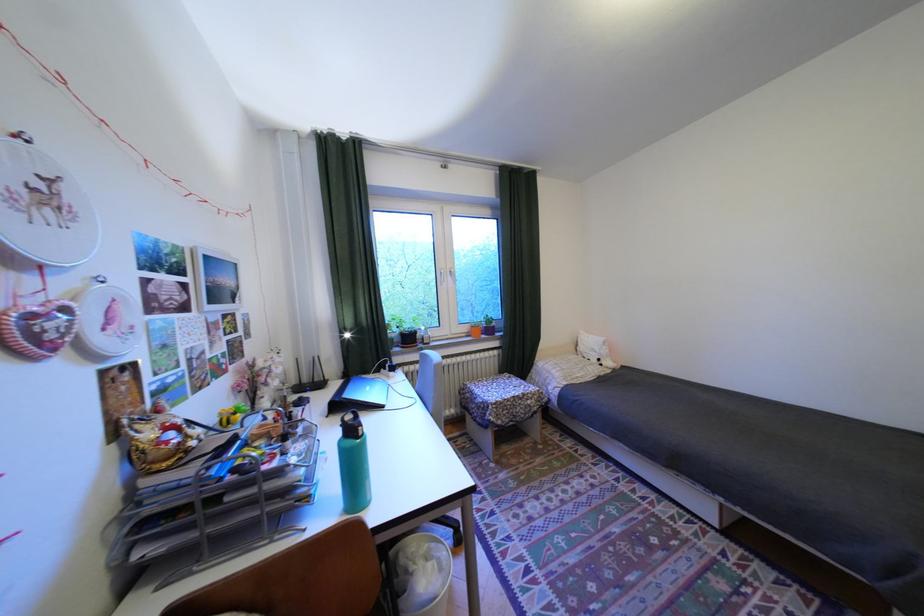
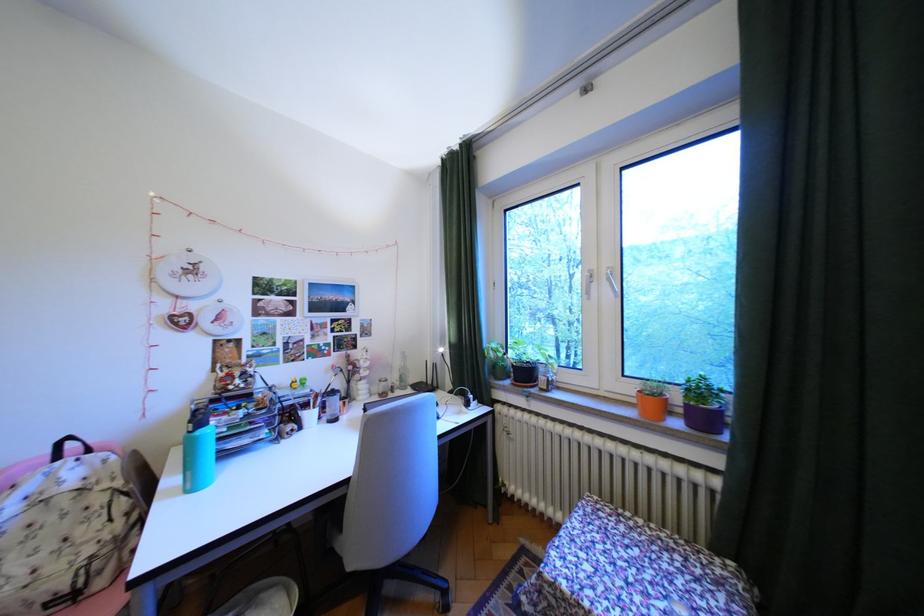
Find the pixel in the second image that matches point (478, 329) in the first image.

(641, 390)